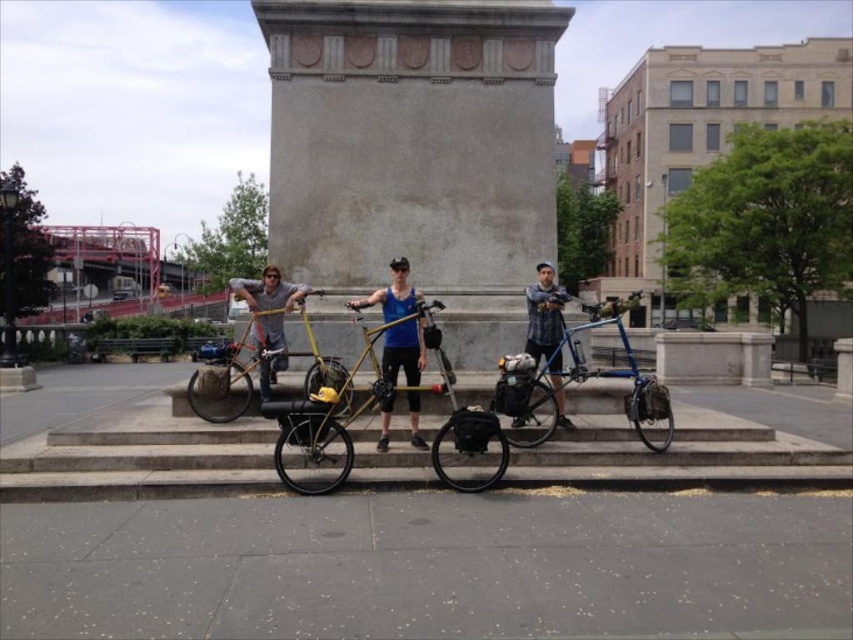
Is point (537, 164) closer to camera compared to point (19, 456)?

No, it is behind (19, 456).

Looking at this image, is smooth concrete monument at center below concrete stairs at center?

Actually, smooth concrete monument at center is above concrete stairs at center.

Does point (496, 276) come behind point (256, 435)?

That is True.

You are a GUI agent. You are given a task and a screenshot of the screen. Output one action in this format:
    pyautogui.click(x=<x>, y=<y>)
    Task: Click on the smooth concrete monument at center
    This screenshot has width=853, height=640.
    Given the screenshot: What is the action you would take?
    pyautogui.click(x=410, y=138)

Can you confirm if concrete stairs at center is positioned to the left of matte gray shirt at center?

Incorrect, concrete stairs at center is not on the left side of matte gray shirt at center.

Is concrete stairs at center wider than matte gray shirt at center?

Correct, the width of concrete stairs at center exceeds that of matte gray shirt at center.

This screenshot has width=853, height=640. What do you see at coordinates (683, 451) in the screenshot?
I see `concrete stairs at center` at bounding box center [683, 451].

Locate an element on the screen. concrete stairs at center is located at coordinates (683, 451).

Consider the image. Is smooth concrete monument at center smaller than yellow matte bicycle at center?

Indeed, smooth concrete monument at center has a smaller size compared to yellow matte bicycle at center.

Is point (407, 195) positioned before point (225, 404)?

No, it is not.

Between point (349, 38) and point (212, 360), which one is positioned in front?

Point (212, 360)

Find the location of a particular element. The height and width of the screenshot is (640, 853). smooth concrete monument at center is located at coordinates point(410,138).